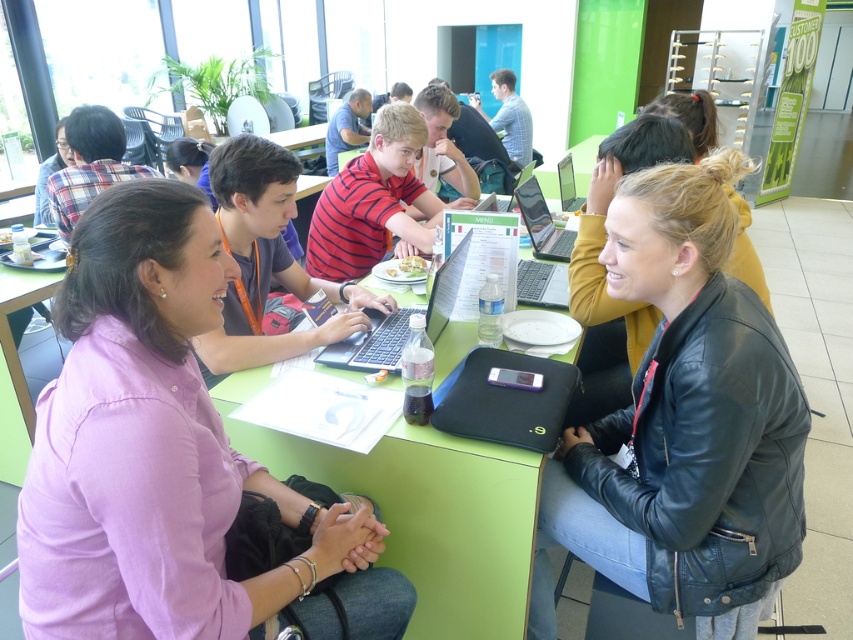
You are a customer at the cafe and want to place an order with the barista. You need to hand them a coupon that is on the shiny silver laptop at center. However, the barista is standing to the right of the silver metallic laptop at center. To reach the coupon without moving the laptop, which laptop should you use?

The shiny silver laptop at center is to the left of the silver metallic laptop at center. Since the barista is to the right of the silver metallic laptop at center, the coupon on the shiny silver laptop at center would require you to move towards the left side of the table to access it, which might be less convenient if the barista is on the right. However, if you need to hand the coupon without moving the laptop, you should use the shiny silver laptop at center as it is the one with the coupon. But since

You are a person who wants to place a book on the green plastic table at lower left and the silver metallic laptop at center. Which surface will require you to bend down more to place the book?

The green plastic table at lower left is much taller than the silver metallic laptop at center, so placing the book on the green plastic table at lower left will require bending down more because it is higher.